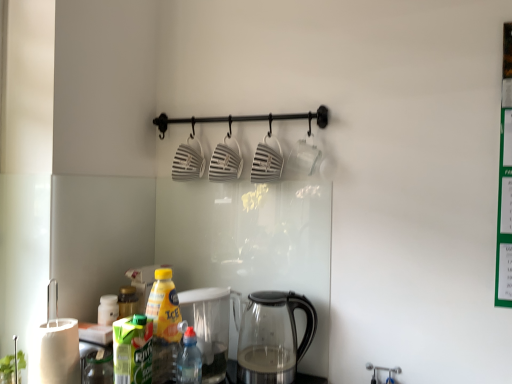
The image size is (512, 384). Identify the location of yellow plastic bottle at lower left, arranged as the first bottle when viewed from the left. (164, 325).

What is the approximate height of translucent plastic bottle at lower center, which is the first bottle from right to left?

translucent plastic bottle at lower center, which is the first bottle from right to left, is 7.73 inches tall.

The width and height of the screenshot is (512, 384). In order to click on yellow plastic bottle at lower left, placed as the 2th bottle when sorted from right to left in this screenshot , I will do 164,325.

From the image's perspective, which object appears higher, transparent glass kettle at lower center or translucent plastic bottle at lower center, which is the first bottle from right to left?

transparent glass kettle at lower center is shown above in the image.

Is translucent plastic bottle at lower center, arranged as the 2th bottle when viewed from the left, at the back of transparent glass kettle at lower center?

transparent glass kettle at lower center is not turned away from translucent plastic bottle at lower center, arranged as the 2th bottle when viewed from the left.

Is transparent glass kettle at lower center taller than translucent plastic bottle at lower center, which is the first bottle from right to left?

Indeed, transparent glass kettle at lower center has a greater height compared to translucent plastic bottle at lower center, which is the first bottle from right to left.

The image size is (512, 384). Find the location of `kettle above the translucent plastic bottle at lower center, which is the first bottle from right to left (from the image's perspective)`. kettle above the translucent plastic bottle at lower center, which is the first bottle from right to left (from the image's perspective) is located at coordinates (272, 337).

Is translucent plastic bottle at lower center, which is the first bottle from right to left, behind transparent glass kettle at lower center?

No, translucent plastic bottle at lower center, which is the first bottle from right to left, is in front of transparent glass kettle at lower center.

Is translucent plastic bottle at lower center, which is the first bottle from right to left, oriented towards transparent glass kettle at lower center?

No, translucent plastic bottle at lower center, which is the first bottle from right to left, is not aimed at transparent glass kettle at lower center.

In the image, there is a translucent plastic bottle at lower center, arranged as the 2th bottle when viewed from the left. At what (x,y) coordinates should I click in order to perform the action: click on kettle above it (from the image's perspective). Please return your answer as a coordinate pair (x, y). Looking at the image, I should click on (272, 337).

How different are the orientations of translucent plastic bottle at lower center, which is the first bottle from right to left, and transparent glass kettle at lower center in degrees?

translucent plastic bottle at lower center, which is the first bottle from right to left, and transparent glass kettle at lower center are facing 0.515 degrees away from each other.

Which object is closer to the camera, yellow plastic bottle at lower left, arranged as the first bottle when viewed from the left, or translucent plastic bottle at lower center, which is the first bottle from right to left?

translucent plastic bottle at lower center, which is the first bottle from right to left.

Which is further, (156, 355) or (191, 362)?

Point (156, 355)

Can you confirm if yellow plastic bottle at lower left, placed as the 2th bottle when sorted from right to left, is thinner than translucent plastic bottle at lower center, which is the first bottle from right to left?

No.

Between yellow plastic bottle at lower left, arranged as the first bottle when viewed from the left, and transparent glass kettle at lower center, which one has more height?

yellow plastic bottle at lower left, arranged as the first bottle when viewed from the left, is taller.

Can you see yellow plastic bottle at lower left, placed as the 2th bottle when sorted from right to left, touching transparent glass kettle at lower center?

No, yellow plastic bottle at lower left, placed as the 2th bottle when sorted from right to left, is not touching transparent glass kettle at lower center.

How distant is yellow plastic bottle at lower left, arranged as the first bottle when viewed from the left, from transparent glass kettle at lower center?

yellow plastic bottle at lower left, arranged as the first bottle when viewed from the left, and transparent glass kettle at lower center are 10.63 inches apart from each other.

From the image's perspective, who appears lower, yellow plastic bottle at lower left, arranged as the first bottle when viewed from the left, or transparent glass kettle at lower center?

transparent glass kettle at lower center is shown below in the image.

Does translucent plastic bottle at lower center, arranged as the 2th bottle when viewed from the left, have a greater width compared to yellow plastic bottle at lower left, placed as the 2th bottle when sorted from right to left?

No, translucent plastic bottle at lower center, arranged as the 2th bottle when viewed from the left, is not wider than yellow plastic bottle at lower left, placed as the 2th bottle when sorted from right to left.

Who is bigger, translucent plastic bottle at lower center, which is the first bottle from right to left, or yellow plastic bottle at lower left, placed as the 2th bottle when sorted from right to left?

With larger size is yellow plastic bottle at lower left, placed as the 2th bottle when sorted from right to left.

Can we say translucent plastic bottle at lower center, which is the first bottle from right to left, lies outside yellow plastic bottle at lower left, arranged as the first bottle when viewed from the left?

translucent plastic bottle at lower center, which is the first bottle from right to left, lies outside yellow plastic bottle at lower left, arranged as the first bottle when viewed from the left,'s area.

Based on the photo, from the image's perspective, is translucent plastic bottle at lower center, arranged as the 2th bottle when viewed from the left, above yellow plastic bottle at lower left, arranged as the first bottle when viewed from the left?

No, from the image's perspective, translucent plastic bottle at lower center, arranged as the 2th bottle when viewed from the left, is not above yellow plastic bottle at lower left, arranged as the first bottle when viewed from the left.

Is transparent glass kettle at lower center oriented away from yellow plastic bottle at lower left, arranged as the first bottle when viewed from the left?

transparent glass kettle at lower center does not have its back to yellow plastic bottle at lower left, arranged as the first bottle when viewed from the left.

Is transparent glass kettle at lower center far away from yellow plastic bottle at lower left, arranged as the first bottle when viewed from the left?

No.

Is transparent glass kettle at lower center inside or outside of yellow plastic bottle at lower left, arranged as the first bottle when viewed from the left?

transparent glass kettle at lower center is not enclosed by yellow plastic bottle at lower left, arranged as the first bottle when viewed from the left.

Measure the distance between transparent glass kettle at lower center and yellow plastic bottle at lower left, placed as the 2th bottle when sorted from right to left.

The distance of transparent glass kettle at lower center from yellow plastic bottle at lower left, placed as the 2th bottle when sorted from right to left, is 10.63 inches.

I want to click on bottle lying below the transparent glass kettle at lower center (from the image's perspective), so click(x=189, y=360).

At what (x,y) coordinates should I click in order to perform the action: click on bottle that is the 2nd one when counting forward from the transparent glass kettle at lower center. Please return your answer as a coordinate pair (x, y). Looking at the image, I should click on (189, 360).

Looking at this image, which object lies further to the anchor point yellow plastic bottle at lower left, arranged as the first bottle when viewed from the left, transparent glass kettle at lower center or translucent plastic bottle at lower center, which is the first bottle from right to left?

transparent glass kettle at lower center is positioned further to the anchor yellow plastic bottle at lower left, arranged as the first bottle when viewed from the left.

Estimate the real-world distances between objects in this image. Which object is further from translucent plastic bottle at lower center, arranged as the 2th bottle when viewed from the left, transparent glass kettle at lower center or yellow plastic bottle at lower left, arranged as the first bottle when viewed from the left?

Among the two, transparent glass kettle at lower center is located further to translucent plastic bottle at lower center, arranged as the 2th bottle when viewed from the left.

When comparing their distances from translucent plastic bottle at lower center, which is the first bottle from right to left, does yellow plastic bottle at lower left, arranged as the first bottle when viewed from the left, or transparent glass kettle at lower center seem closer?

yellow plastic bottle at lower left, arranged as the first bottle when viewed from the left, is closer to translucent plastic bottle at lower center, which is the first bottle from right to left.

Estimate the real-world distances between objects in this image. Which object is closer to yellow plastic bottle at lower left, arranged as the first bottle when viewed from the left, translucent plastic bottle at lower center, arranged as the 2th bottle when viewed from the left, or transparent glass kettle at lower center?

Based on the image, translucent plastic bottle at lower center, arranged as the 2th bottle when viewed from the left, appears to be nearer to yellow plastic bottle at lower left, arranged as the first bottle when viewed from the left.

Looking at the image, which one is located further to transparent glass kettle at lower center, yellow plastic bottle at lower left, arranged as the first bottle when viewed from the left, or translucent plastic bottle at lower center, arranged as the 2th bottle when viewed from the left?

yellow plastic bottle at lower left, arranged as the first bottle when viewed from the left, is further to transparent glass kettle at lower center.

Estimate the real-world distances between objects in this image. Which object is closer to transparent glass kettle at lower center, translucent plastic bottle at lower center, arranged as the 2th bottle when viewed from the left, or yellow plastic bottle at lower left, placed as the 2th bottle when sorted from right to left?

translucent plastic bottle at lower center, arranged as the 2th bottle when viewed from the left, is positioned closer to the anchor transparent glass kettle at lower center.

Locate an element on the screen. This screenshot has height=384, width=512. bottle situated between yellow plastic bottle at lower left, placed as the 2th bottle when sorted from right to left, and transparent glass kettle at lower center from left to right is located at coordinates (189, 360).